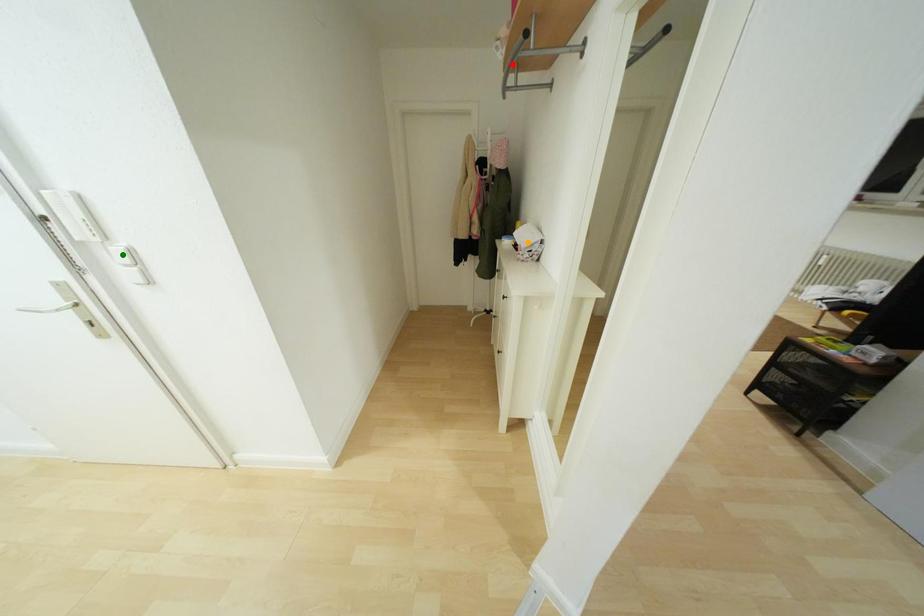
From the picture: Order these from nearest to farthest:
- red point
- green point
- orange point

green point < red point < orange point